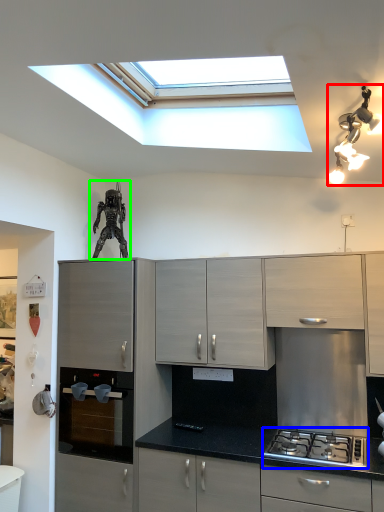
Question: Which is farther away from light fixture (highlighted by a red box)? gas stove (highlighted by a blue box) or sculpture (highlighted by a green box)?

Choices:
 (A) gas stove
 (B) sculpture

Answer: (B)